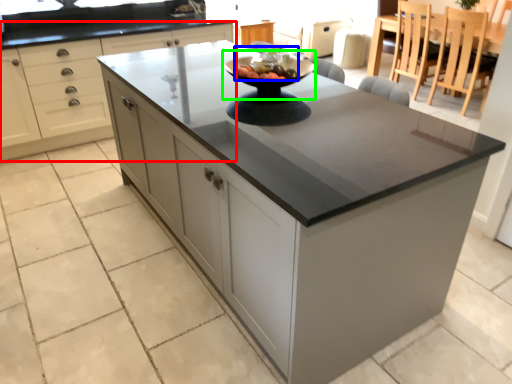
Question: Based on their relative distances, which object is farther from cabinetry (highlighted by a red box)? Choose from fruit salad (highlighted by a blue box) and mixing bowl (highlighted by a green box).

Choices:
 (A) fruit salad
 (B) mixing bowl

Answer: (A)